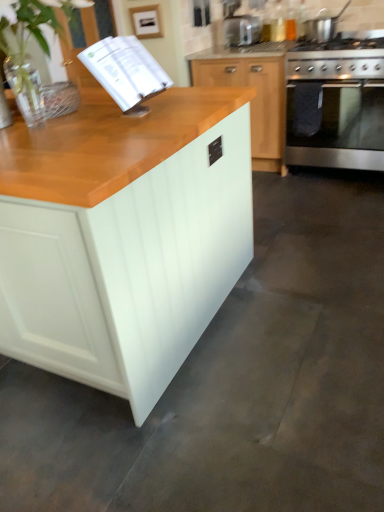
Question: Can you confirm if white matte cabinet at center, placed as the 2th cabinetry when sorted from right to left, is shorter than white paper book at upper left?

Choices:
 (A) no
 (B) yes

Answer: (A)

Question: Considering the relative sizes of white matte cabinet at center, placed as the 2th cabinetry when sorted from right to left, and white paper book at upper left in the image provided, is white matte cabinet at center, placed as the 2th cabinetry when sorted from right to left, thinner than white paper book at upper left?

Choices:
 (A) yes
 (B) no

Answer: (B)

Question: Is white matte cabinet at center, arranged as the 2th cabinetry when viewed from the back, facing towards white paper book at upper left?

Choices:
 (A) yes
 (B) no

Answer: (B)

Question: Considering the relative positions of white matte cabinet at center, the 1th cabinetry from the front, and white paper book at upper left in the image provided, is white matte cabinet at center, the 1th cabinetry from the front, to the right of white paper book at upper left from the viewer's perspective?

Choices:
 (A) yes
 (B) no

Answer: (B)

Question: Is white matte cabinet at center, arranged as the 2th cabinetry when viewed from the back, behind white paper book at upper left?

Choices:
 (A) no
 (B) yes

Answer: (A)

Question: From the image's perspective, is white paper book at upper left located above or below stainless steel pot at upper right?

Choices:
 (A) below
 (B) above

Answer: (A)

Question: Choose the correct answer: Is white paper book at upper left inside stainless steel pot at upper right or outside it?

Choices:
 (A) inside
 (B) outside

Answer: (B)

Question: Based on their sizes in the image, would you say white paper book at upper left is bigger or smaller than stainless steel pot at upper right?

Choices:
 (A) big
 (B) small

Answer: (A)

Question: Would you say white paper book at upper left is to the left or to the right of stainless steel pot at upper right in the picture?

Choices:
 (A) right
 (B) left

Answer: (B)

Question: From the image's perspective, is white matte cabinet at center, the 1th cabinetry when ordered from left to right, positioned above or below satin silver toaster at upper center?

Choices:
 (A) above
 (B) below

Answer: (B)

Question: Considering the positions of white matte cabinet at center, placed as the 2th cabinetry when sorted from right to left, and satin silver toaster at upper center in the image, is white matte cabinet at center, placed as the 2th cabinetry when sorted from right to left, taller or shorter than satin silver toaster at upper center?

Choices:
 (A) short
 (B) tall

Answer: (B)

Question: Considering their positions, is white matte cabinet at center, arranged as the 2th cabinetry when viewed from the back, located in front of or behind satin silver toaster at upper center?

Choices:
 (A) front
 (B) behind

Answer: (A)

Question: Does point tap(152, 128) appear closer or farther from the camera than point tap(241, 24)?

Choices:
 (A) farther
 (B) closer

Answer: (B)

Question: From a real-world perspective, is satin silver toaster at upper center physically located above or below stainless steel oven at right?

Choices:
 (A) above
 (B) below

Answer: (A)

Question: Is point (226, 33) closer or farther from the camera than point (334, 112)?

Choices:
 (A) closer
 (B) farther

Answer: (B)